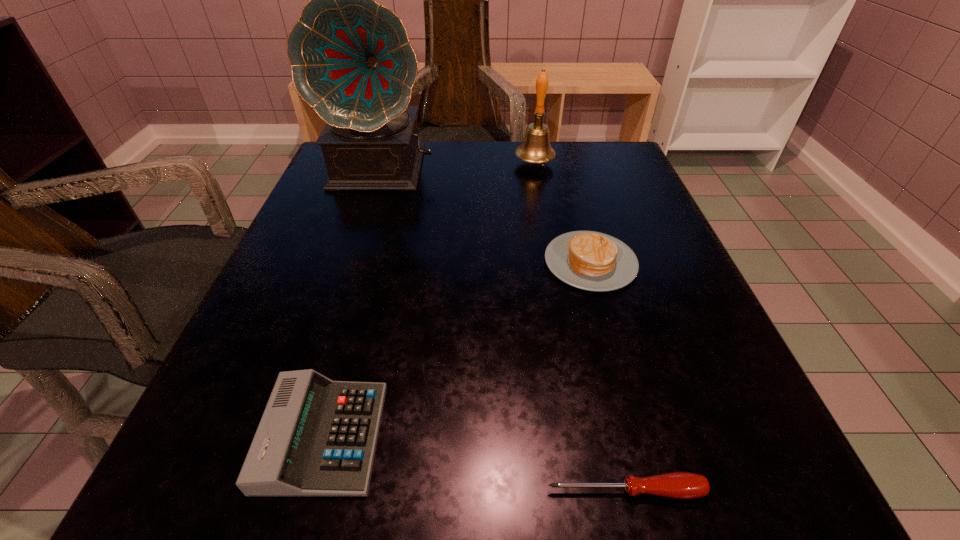
In order to click on object that is positioned at the near right corner in this screenshot , I will do `click(683, 485)`.

The width and height of the screenshot is (960, 540). Identify the location of vacant space at the far edge of the desktop. (468, 165).

Locate an element on the screen. The height and width of the screenshot is (540, 960). vacant space at the near edge is located at coordinates (456, 480).

Image resolution: width=960 pixels, height=540 pixels. In order to click on vacant space at the left edge of the desktop in this screenshot , I will do `click(310, 368)`.

Image resolution: width=960 pixels, height=540 pixels. Find the location of `free space at the right edge of the desktop`. free space at the right edge of the desktop is located at coordinates (675, 250).

Locate an element on the screen. This screenshot has width=960, height=540. vacant space at the far right corner of the desktop is located at coordinates (612, 152).

At what (x,y) coordinates should I click in order to perform the action: click on free space at the near right corner of the desktop. Please return your answer as a coordinate pair (x, y). Looking at the image, I should click on (723, 491).

Find the location of a particular element. The width and height of the screenshot is (960, 540). free space between the calculator and the shortest object is located at coordinates (474, 463).

The height and width of the screenshot is (540, 960). Identify the location of vacant area between the bell and the calculator. (429, 300).

Where is `vacant space that is in between the bell and the tallest object`? This screenshot has width=960, height=540. vacant space that is in between the bell and the tallest object is located at coordinates tap(459, 166).